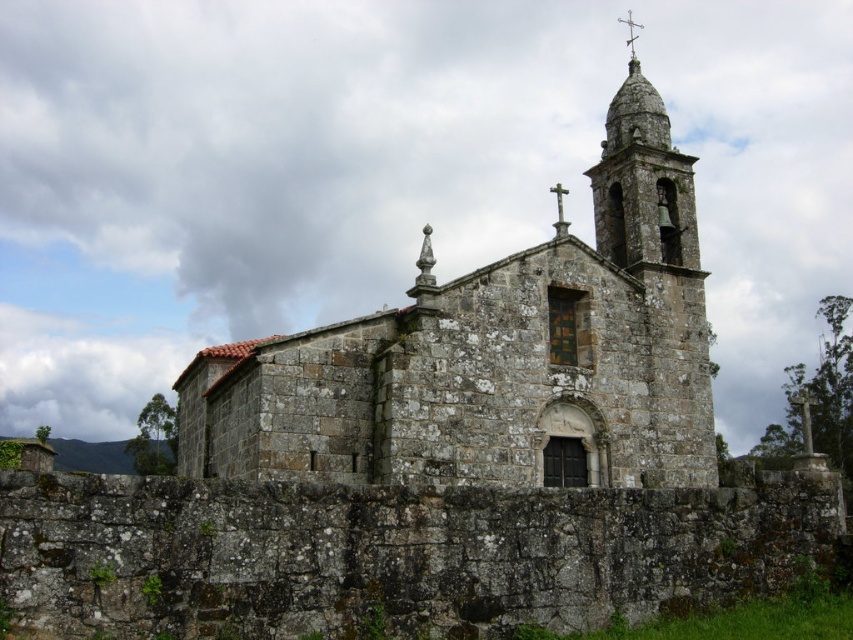
This screenshot has height=640, width=853. Describe the element at coordinates (496, 355) in the screenshot. I see `rustic stone church at center` at that location.

Can you confirm if rustic stone church at center is taller than metallic cross at upper center?

Incorrect, rustic stone church at center's height is not larger of metallic cross at upper center's.

Consider the image. Measure the distance between rustic stone church at center and camera.

rustic stone church at center and camera are 143.87 feet apart from each other.

This screenshot has width=853, height=640. Find the location of `rustic stone church at center`. rustic stone church at center is located at coordinates (496, 355).